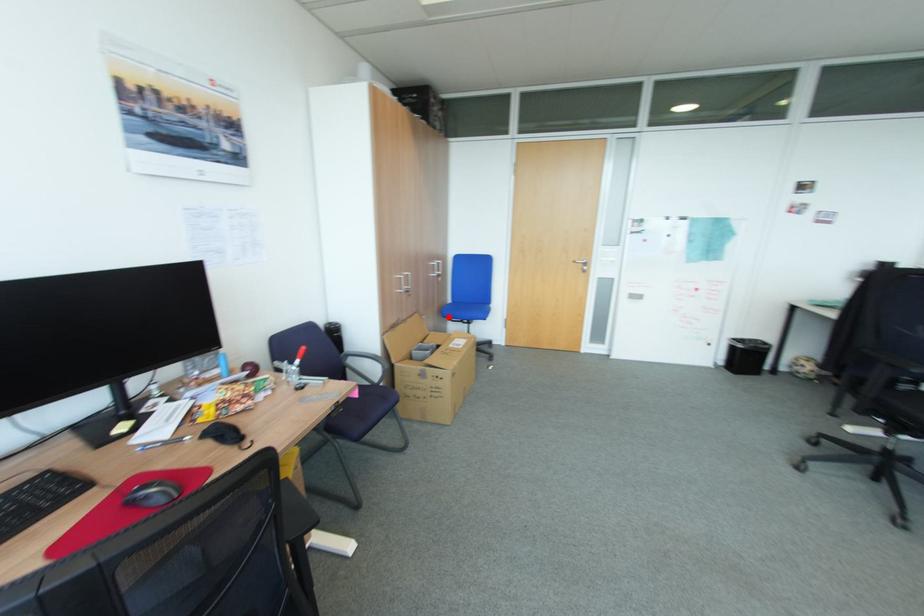
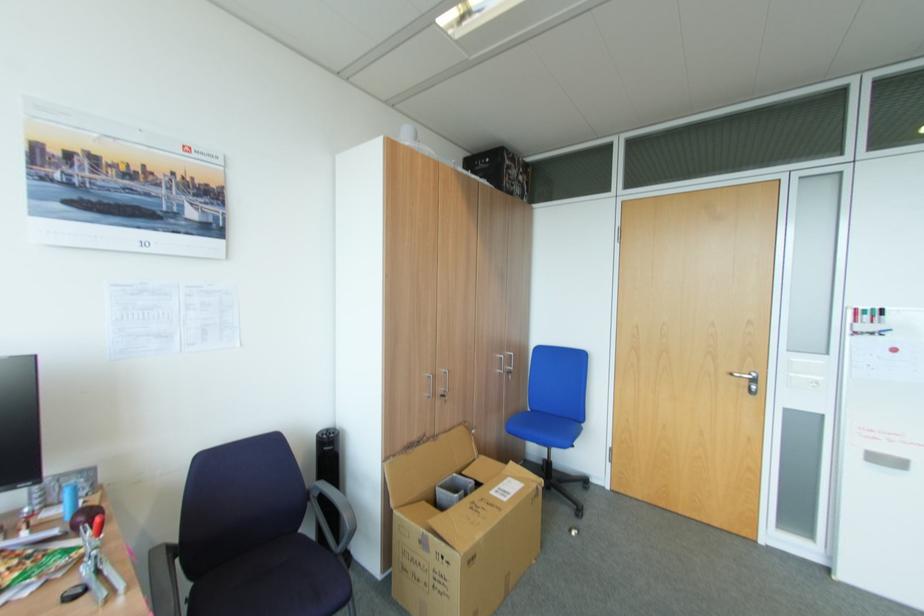
Question: I am providing you with two images of the same scene from different viewpoints. In image1, a red point is highlighted. Considering the same 3D point in image2, which of the following is correct?

Choices:
 (A) It is closer
 (B) It is farther

Answer: (A)